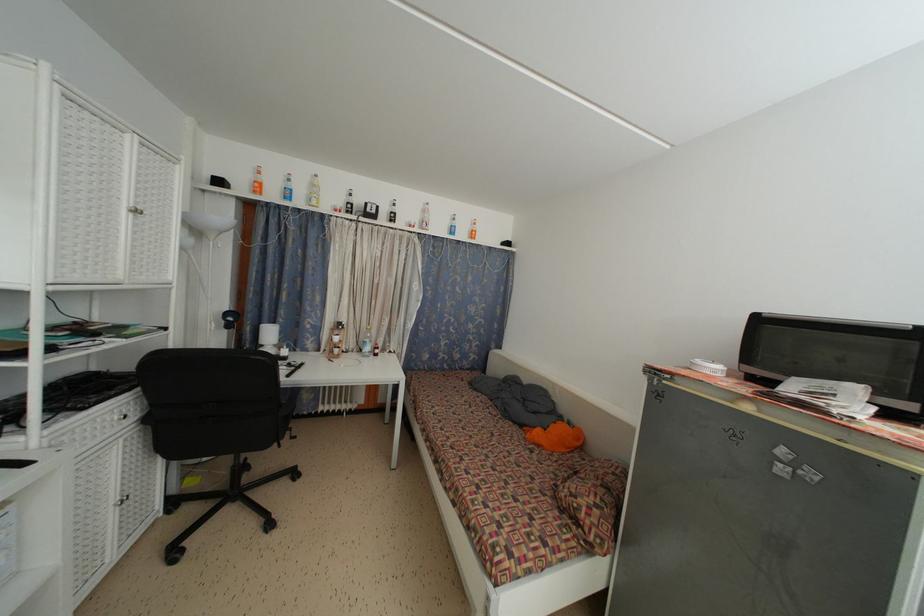
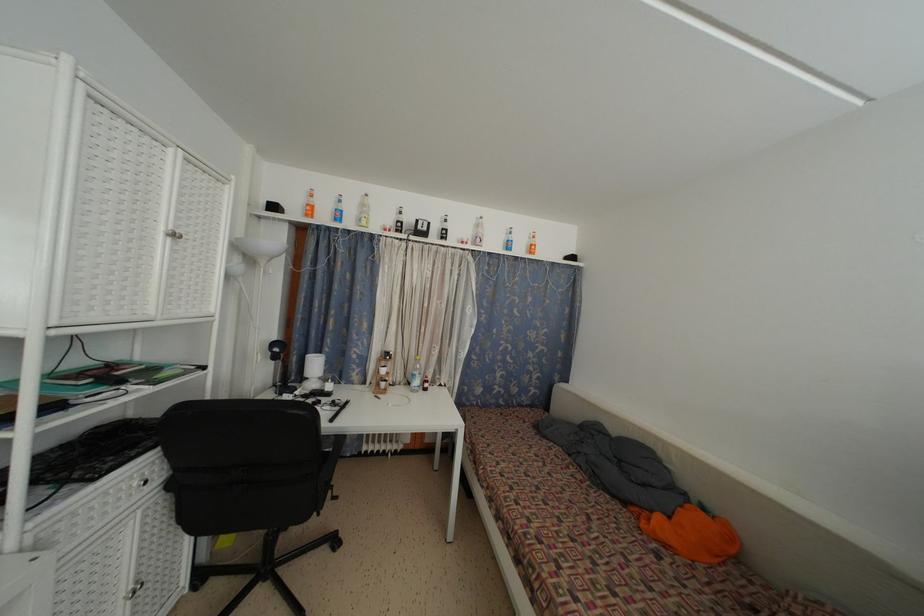
Locate, in the second image, the point that corresponds to [319,192] in the first image.

(368, 213)